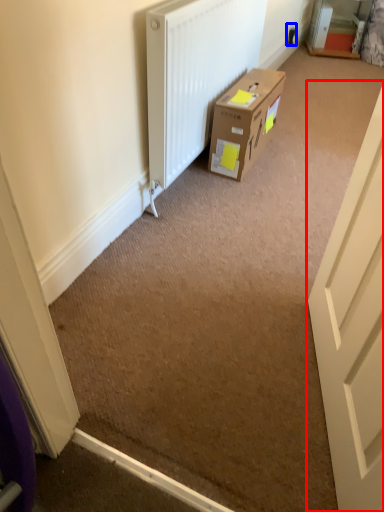
Question: Among these objects, which one is nearest to the camera, door (highlighted by a red box) or electric outlet (highlighted by a blue box)?

Choices:
 (A) door
 (B) electric outlet

Answer: (A)